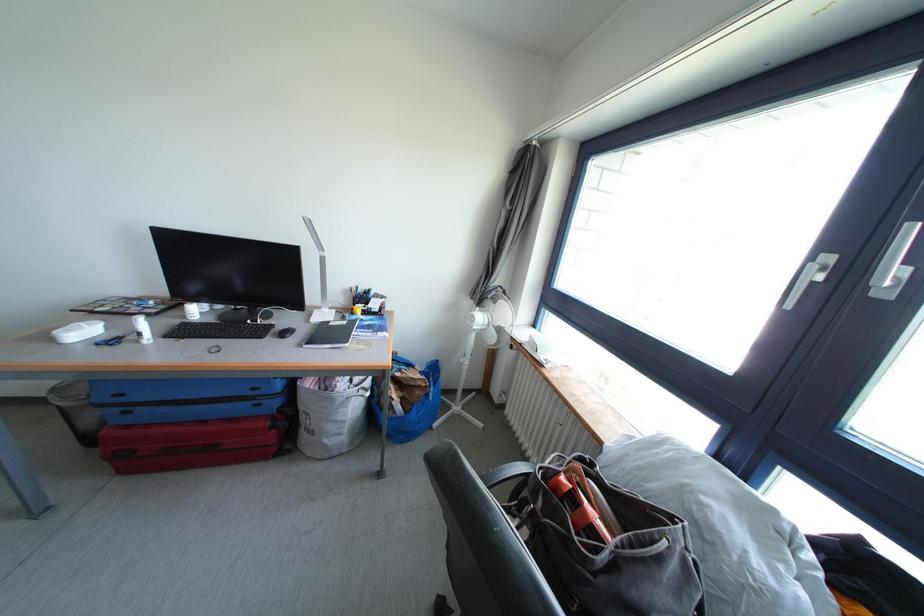
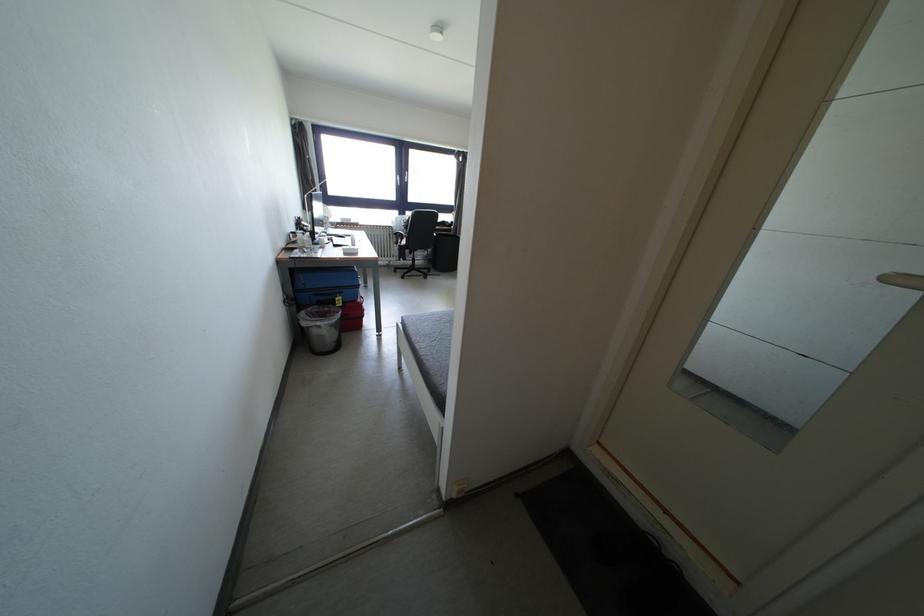
Question: I am providing you with two images of the same scene from different viewpoints. Which of the following objects are not visible in image2?

Choices:
 (A) black cylindrical bin
 (B) black computer mouse
 (C) yellow-lidded box
 (D) chair sitting surface

Answer: (B)